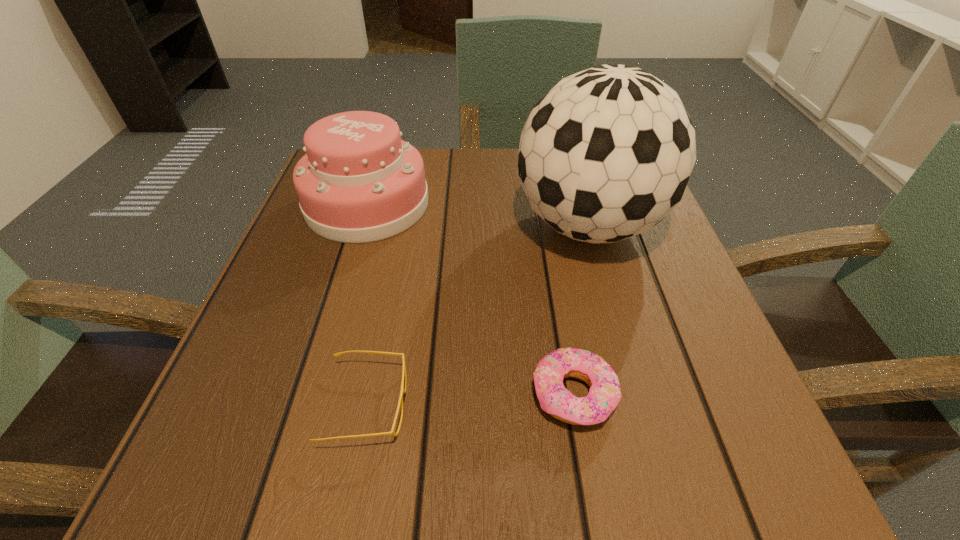
Find the location of a particular element. This screenshot has height=540, width=960. empty space that is in between the doughnut and the tallest object is located at coordinates (581, 310).

The image size is (960, 540). In order to click on vacant area between the spectacles and the soccer ball in this screenshot , I will do 477,315.

Identify the location of object that stands as the closest to the third shortest object. (606, 154).

You are a GUI agent. You are given a task and a screenshot of the screen. Output one action in this format:
    pyautogui.click(x=<x>, y=<y>)
    Task: Click on the third closest object to the spectacles
    
    Given the screenshot: What is the action you would take?
    pyautogui.click(x=358, y=182)